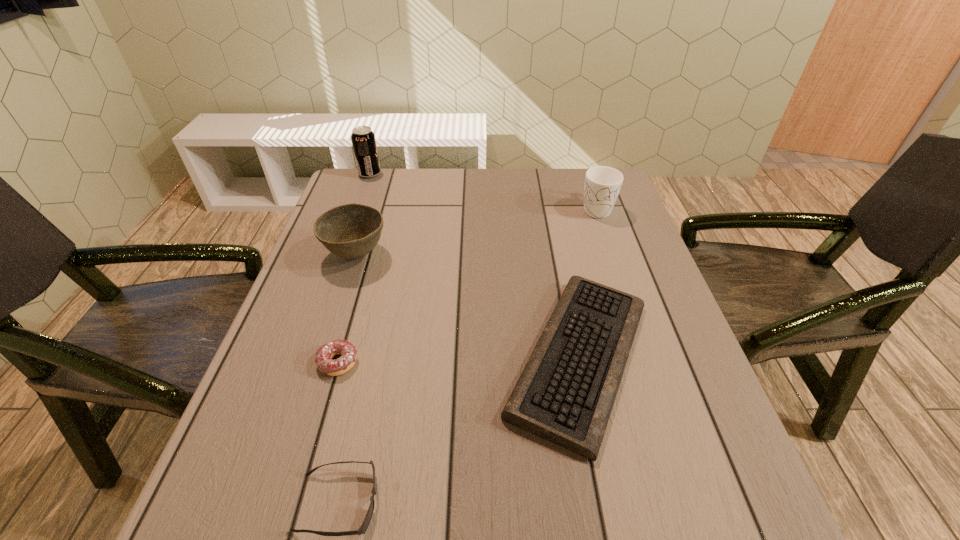
Locate an element on the screen. free region at the far edge of the desktop is located at coordinates (557, 176).

In the image, there is a desktop. Identify the location of vacant space at the near edge. The width and height of the screenshot is (960, 540). (319, 496).

Where is `vacant point at the left edge`? The image size is (960, 540). vacant point at the left edge is located at coordinates (311, 273).

Locate an element on the screen. vacant space at the right edge of the desktop is located at coordinates (643, 251).

Locate an element on the screen. The height and width of the screenshot is (540, 960). vacant space at the far left corner is located at coordinates (392, 174).

Find the location of `free space at the near left corner`. free space at the near left corner is located at coordinates (228, 499).

The width and height of the screenshot is (960, 540). I want to click on blank region between the bowl and the computer keyboard, so click(x=468, y=307).

The image size is (960, 540). What are the coordinates of `vacant area that lies between the doughnut and the second farthest object` in the screenshot? It's located at (468, 285).

Where is `free space between the computer keyboard and the doughnut`? The image size is (960, 540). free space between the computer keyboard and the doughnut is located at coordinates (459, 360).

Image resolution: width=960 pixels, height=540 pixels. I want to click on free space between the tallest object and the fifth nearest object, so (x=483, y=191).